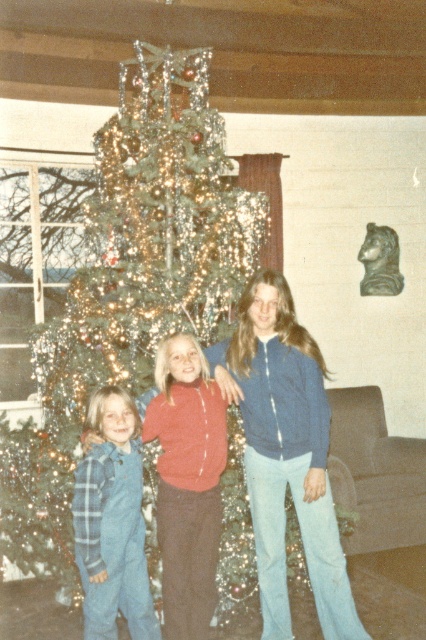
Question: Does blue denim jacket at center have a larger size compared to blue corduroy pants at lower left?

Choices:
 (A) no
 (B) yes

Answer: (B)

Question: Can you confirm if blue corduroy pants at lower left is positioned to the left of blue plaid overalls at lower left?

Choices:
 (A) yes
 (B) no

Answer: (B)

Question: Which object is positioned farthest from the blue plaid overalls at lower left?

Choices:
 (A) blue corduroy pants at lower left
 (B) green shiny christmas tree at center

Answer: (B)

Question: Can you confirm if green shiny christmas tree at center is positioned to the left of blue corduroy pants at lower left?

Choices:
 (A) no
 (B) yes

Answer: (B)

Question: Which of the following is the closest to the observer?

Choices:
 (A) (271, 506)
 (B) (167, 618)

Answer: (B)

Question: Which of the following is the closest to the observer?

Choices:
 (A) (137, 454)
 (B) (132, 260)
 (C) (213, 540)
 (D) (328, 436)

Answer: (C)